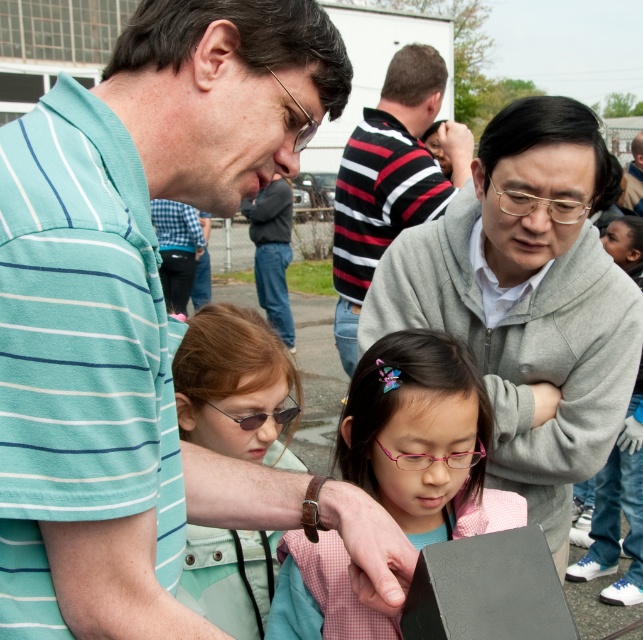
Which of these two, gray fleece sweater at upper right or pink plastic glasses at center, stands shorter?

pink plastic glasses at center is shorter.

This screenshot has height=640, width=643. I want to click on gray fleece sweater at upper right, so click(x=619, y=512).

Is point (629, 476) more distant than point (417, 456)?

That is True.

Image resolution: width=643 pixels, height=640 pixels. Identify the location of gray fleece sweater at upper right. (619, 512).

Can you confirm if striped cotton shirt at center is bigger than metallic wireframe glasses at center?

Yes.

Is striped cotton shirt at center shorter than metallic wireframe glasses at center?

No.

Where is `striped cotton shirt at center`? striped cotton shirt at center is located at coordinates (390, 179).

Can you confirm if gray fleece sweater at upper right is positioned above gold metallic glasses at upper center?

No.

Who is more forward, (606, 237) or (561, 204)?

Point (561, 204)

Image resolution: width=643 pixels, height=640 pixels. I want to click on gray fleece sweater at upper right, so click(619, 512).